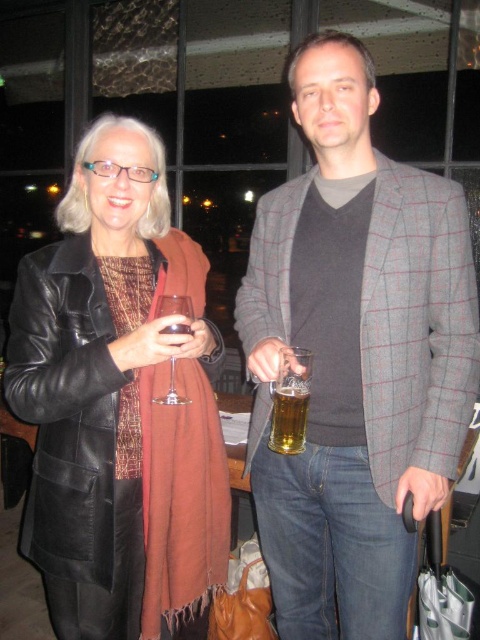
Question: Does gray checkered blazer at center have a lesser width compared to translucent glass beer at center?

Choices:
 (A) no
 (B) yes

Answer: (A)

Question: Which point appears closest to the camera in this image?

Choices:
 (A) [x=178, y=305]
 (B) [x=359, y=310]

Answer: (A)

Question: Does leather jacket at left have a smaller size compared to transparent glass at center?

Choices:
 (A) no
 (B) yes

Answer: (A)

Question: Which point appears farthest from the camera in this image?

Choices:
 (A) (169, 396)
 (B) (115, 445)

Answer: (B)

Question: Can you confirm if gray checkered blazer at center is bigger than transparent glass at center?

Choices:
 (A) no
 (B) yes

Answer: (B)

Question: Which point appears farthest from the camera in this image?

Choices:
 (A) (274, 419)
 (B) (455, 275)
 (C) (192, 580)
 (D) (171, 380)

Answer: (C)